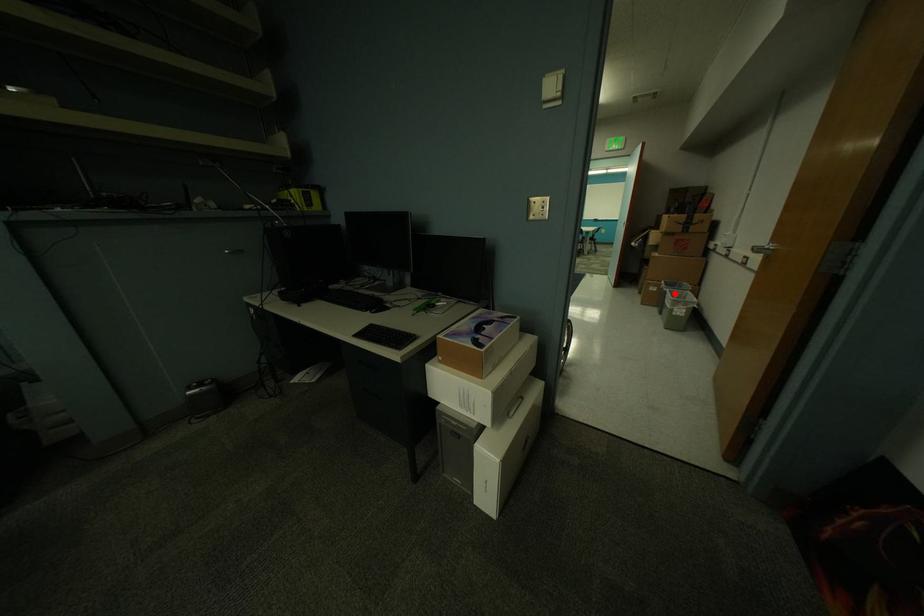
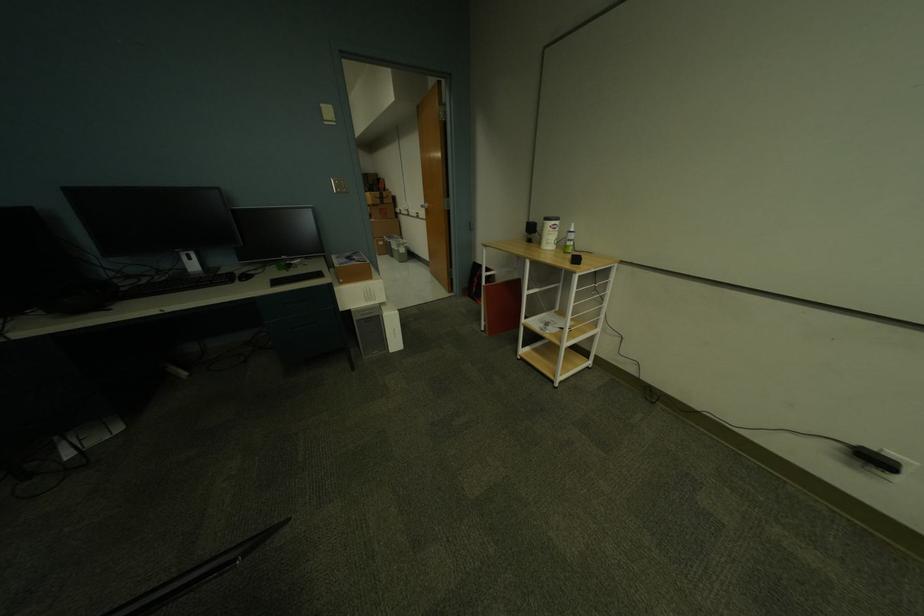
Where in the second image is the point corresponding to the highlighted location from the first image?

(398, 244)